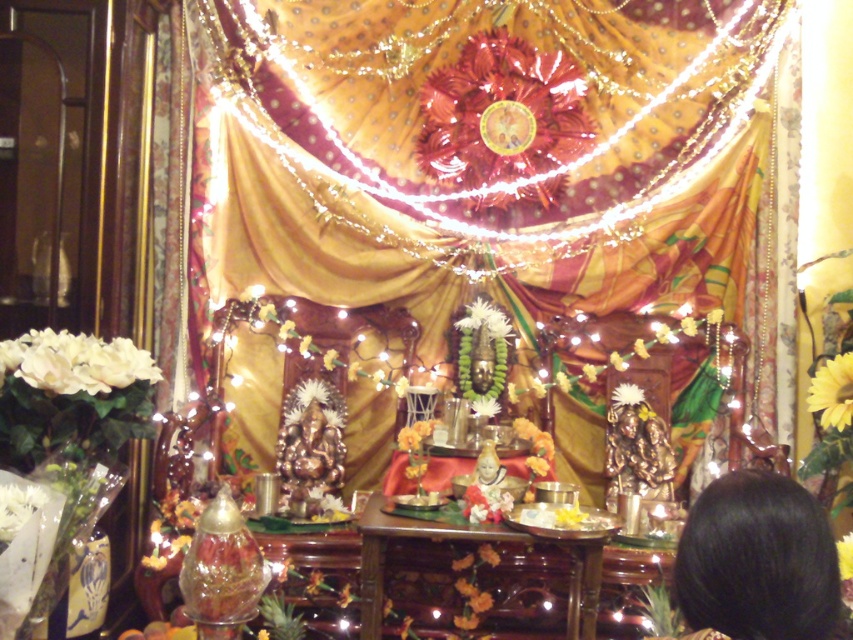
You are a visitor at the altar and want to place a new offering. The altar has white matte flowers at left and white matte flower at center. Which of these two flowers is larger?

The white matte flowers at left is bigger than the white matte flower at center.

You are an interior designer planning to add a new decorative item to the altar. The item you want to place is 1 meter tall. Considering the gold satin curtain at upper center and the yellow matte flower at upper right, which object is taller and can you determine if your new item will fit above the shorter one?

The gold satin curtain at upper center is taller than the yellow matte flower at upper right. Since the new item is 1 meter tall, it can be placed above the shorter yellow matte flower at upper right if the available space allows, but you need to ensure there is enough vertical clearance.